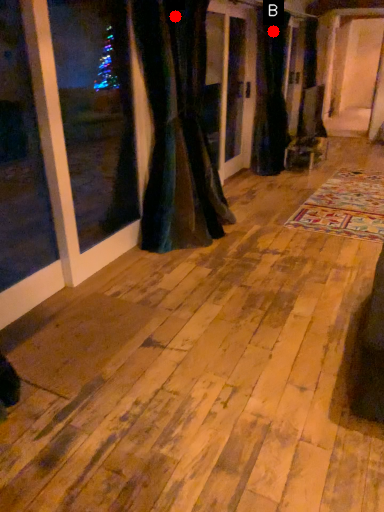
Question: Two points are circled on the image, labeled by A and B beside each circle. Which point is closer to the camera?

Choices:
 (A) A is closer
 (B) B is closer

Answer: (A)